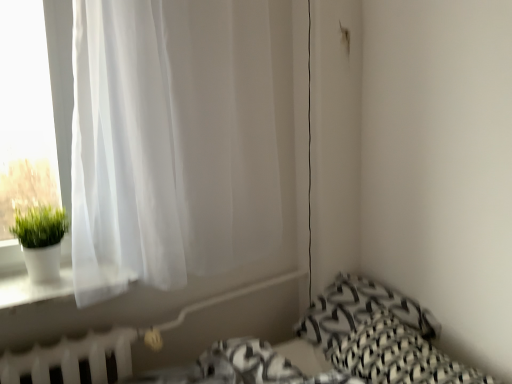
Identify the location of black woven pillow at lower right, acting as the first pillow starting from the back. pos(359,310).

Is white sheer curtain at left to the right of white plastic radiator at lower left from the viewer's perspective?

Yes.

Who is bigger, white sheer curtain at left or white plastic radiator at lower left?

Bigger between the two is white sheer curtain at left.

Consider the image. Would you consider white sheer curtain at left to be distant from white plastic radiator at lower left?

white sheer curtain at left is actually quite close to white plastic radiator at lower left.

Is black woven pillow at lower right, the second pillow positioned from the back, facing towards black woven pillow at lower right, marked as the 2th pillow in a front-to-back arrangement?

No, black woven pillow at lower right, the second pillow positioned from the back, is not aimed at black woven pillow at lower right, marked as the 2th pillow in a front-to-back arrangement.

From a real-world perspective, is black woven pillow at lower right, the 1th pillow when ordered from front to back, located higher than black woven pillow at lower right, acting as the first pillow starting from the back?

Incorrect, from a real-world perspective, black woven pillow at lower right, the 1th pillow when ordered from front to back, is lower than black woven pillow at lower right, acting as the first pillow starting from the back.

Can you tell me how much black woven pillow at lower right, the second pillow positioned from the back, and black woven pillow at lower right, acting as the first pillow starting from the back, differ in facing direction?

black woven pillow at lower right, the second pillow positioned from the back, and black woven pillow at lower right, acting as the first pillow starting from the back, are facing 0.00122 degrees away from each other.

Which of these two, white plastic radiator at lower left or white sheer curtain at left, is wider?

white sheer curtain at left is wider.

Does white plastic radiator at lower left have a larger size compared to white sheer curtain at left?

Incorrect, white plastic radiator at lower left is not larger than white sheer curtain at left.

From a real-world perspective, who is located higher, white plastic radiator at lower left or white sheer curtain at left?

In real-world perspective, white sheer curtain at left is above.

Is white plastic radiator at lower left taller than white sheer curtain at left?

In fact, white plastic radiator at lower left may be shorter than white sheer curtain at left.

Is white matte pot at left next to white plastic radiator at lower left and touching it?

There is a gap between white matte pot at left and white plastic radiator at lower left.

Do you think white matte pot at left is within white plastic radiator at lower left, or outside of it?

white matte pot at left is outside white plastic radiator at lower left.

How distant is white matte pot at left from white plastic radiator at lower left?

The distance of white matte pot at left from white plastic radiator at lower left is 11.59 inches.

From a real-world perspective, is white matte pot at left positioned above or below white plastic radiator at lower left?

In terms of real-world spatial position, white matte pot at left is above white plastic radiator at lower left.

Is black woven pillow at lower right, acting as the first pillow starting from the back, positioned with its back to white matte pot at left?

black woven pillow at lower right, acting as the first pillow starting from the back, does not have its back to white matte pot at left.

From the image's perspective, which is above, black woven pillow at lower right, marked as the 2th pillow in a front-to-back arrangement, or white matte pot at left?

white matte pot at left.

Between black woven pillow at lower right, marked as the 2th pillow in a front-to-back arrangement, and white matte pot at left, which one has larger size?

Bigger between the two is black woven pillow at lower right, marked as the 2th pillow in a front-to-back arrangement.

Considering the sizes of black woven pillow at lower right, marked as the 2th pillow in a front-to-back arrangement, and white matte pot at left in the image, is black woven pillow at lower right, marked as the 2th pillow in a front-to-back arrangement, taller or shorter than white matte pot at left?

black woven pillow at lower right, marked as the 2th pillow in a front-to-back arrangement, is shorter than white matte pot at left.

Measure the distance from white plastic radiator at lower left to black woven pillow at lower right, the 1th pillow when ordered from front to back.

32.81 inches.

Which point is more distant from viewer, (127, 336) or (437, 373)?

The point (127, 336) is more distant.

Does white plastic radiator at lower left come in front of black woven pillow at lower right, the 1th pillow when ordered from front to back?

That is False.

From a real-world perspective, who is located lower, white plastic radiator at lower left or black woven pillow at lower right, the 1th pillow when ordered from front to back?

black woven pillow at lower right, the 1th pillow when ordered from front to back, is physically lower.

Can you confirm if black woven pillow at lower right, marked as the 2th pillow in a front-to-back arrangement, is positioned to the left of white sheer curtain at left?

No, black woven pillow at lower right, marked as the 2th pillow in a front-to-back arrangement, is not to the left of white sheer curtain at left.

Looking at this image, is black woven pillow at lower right, acting as the first pillow starting from the back, facing towards white sheer curtain at left?

No.

Considering the relative sizes of black woven pillow at lower right, marked as the 2th pillow in a front-to-back arrangement, and white sheer curtain at left in the image provided, is black woven pillow at lower right, marked as the 2th pillow in a front-to-back arrangement, thinner than white sheer curtain at left?

In fact, black woven pillow at lower right, marked as the 2th pillow in a front-to-back arrangement, might be wider than white sheer curtain at left.

Where is `pillow that appears behind the white sheer curtain at left`? The width and height of the screenshot is (512, 384). pillow that appears behind the white sheer curtain at left is located at coordinates (359, 310).

What are the coordinates of `curtain above the white plastic radiator at lower left (from the image's perspective)` in the screenshot? It's located at (170, 142).

You are a GUI agent. You are given a task and a screenshot of the screen. Output one action in this format:
    pyautogui.click(x=<x>, y=<y>)
    Task: Click on the pillow above the black woven pillow at lower right, the second pillow positioned from the back (from a real-world perspective)
    The image size is (512, 384).
    Given the screenshot: What is the action you would take?
    pyautogui.click(x=359, y=310)

Looking at the image, which one is located closer to white sheer curtain at left, white plastic radiator at lower left or black woven pillow at lower right, the second pillow positioned from the back?

white plastic radiator at lower left is closer to white sheer curtain at left.

When comparing their distances from black woven pillow at lower right, the 1th pillow when ordered from front to back, does black woven pillow at lower right, acting as the first pillow starting from the back, or white plastic radiator at lower left seem further?

white plastic radiator at lower left.

Which object lies nearer to the anchor point black woven pillow at lower right, the 1th pillow when ordered from front to back, black woven pillow at lower right, acting as the first pillow starting from the back, or white sheer curtain at left?

Among the two, black woven pillow at lower right, acting as the first pillow starting from the back, is located nearer to black woven pillow at lower right, the 1th pillow when ordered from front to back.

Estimate the real-world distances between objects in this image. Which object is further from black woven pillow at lower right, the second pillow positioned from the back, white plastic radiator at lower left or white sheer curtain at left?

The object further to black woven pillow at lower right, the second pillow positioned from the back, is white plastic radiator at lower left.

Based on their spatial positions, is white matte pot at left or black woven pillow at lower right, the 1th pillow when ordered from front to back, closer to black woven pillow at lower right, marked as the 2th pillow in a front-to-back arrangement?

black woven pillow at lower right, the 1th pillow when ordered from front to back, lies closer to black woven pillow at lower right, marked as the 2th pillow in a front-to-back arrangement, than the other object.

Estimate the real-world distances between objects in this image. Which object is closer to black woven pillow at lower right, acting as the first pillow starting from the back, white plastic radiator at lower left or white matte pot at left?

white plastic radiator at lower left is closer to black woven pillow at lower right, acting as the first pillow starting from the back.

Considering their positions, is white matte pot at left positioned further to white sheer curtain at left than black woven pillow at lower right, the 1th pillow when ordered from front to back?

black woven pillow at lower right, the 1th pillow when ordered from front to back, lies further to white sheer curtain at left than the other object.

Which object lies nearer to the anchor point black woven pillow at lower right, the second pillow positioned from the back, white plastic radiator at lower left or white matte pot at left?

Among the two, white plastic radiator at lower left is located nearer to black woven pillow at lower right, the second pillow positioned from the back.

The image size is (512, 384). Find the location of `curtain situated between white matte pot at left and black woven pillow at lower right, the 1th pillow when ordered from front to back, from left to right`. curtain situated between white matte pot at left and black woven pillow at lower right, the 1th pillow when ordered from front to back, from left to right is located at coordinates (170, 142).

In order to click on curtain between white plastic radiator at lower left and black woven pillow at lower right, marked as the 2th pillow in a front-to-back arrangement, in the horizontal direction in this screenshot , I will do `click(170, 142)`.

Identify the location of radiator between white matte pot at left and black woven pillow at lower right, the second pillow positioned from the back, in the horizontal direction. Image resolution: width=512 pixels, height=384 pixels. (72, 358).

The image size is (512, 384). Find the location of `houseplant between white sheer curtain at left and white plastic radiator at lower left from top to bottom`. houseplant between white sheer curtain at left and white plastic radiator at lower left from top to bottom is located at coordinates (41, 240).